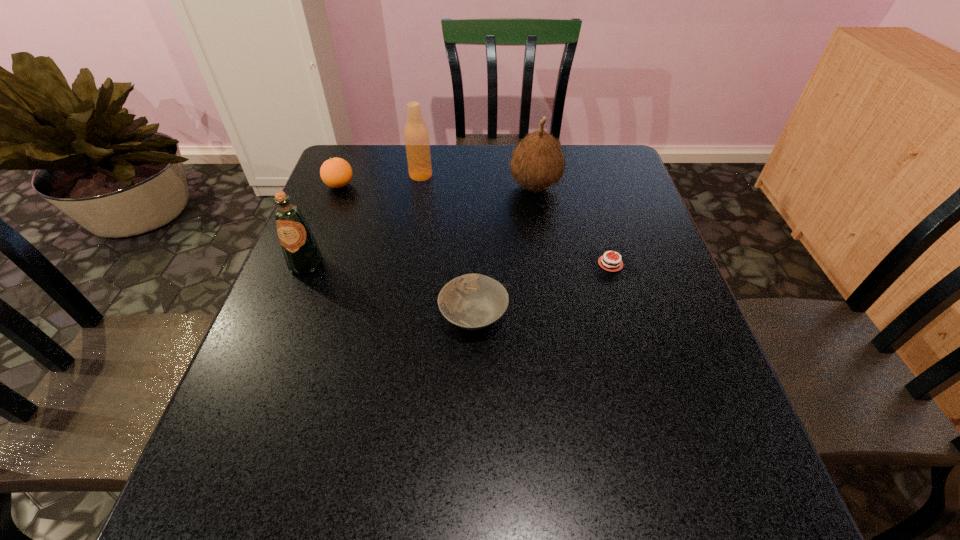
Locate an element on the screen. vacant point located between the beer bottle and the shortest object is located at coordinates (516, 219).

What are the coordinates of `vacant space that is in between the third object from left to right and the second object from right to left` in the screenshot? It's located at (478, 180).

The width and height of the screenshot is (960, 540). What are the coordinates of `free spot between the beer bottle and the fourth tallest object` in the screenshot? It's located at (380, 180).

I want to click on vacant space that's between the olive oil and the shortest object, so click(459, 264).

Identify the location of vacant area that lies between the fourth tallest object and the olive oil. Image resolution: width=960 pixels, height=540 pixels. pyautogui.click(x=324, y=225).

What are the coordinates of `vacant area that lies between the third object from right to left and the coconut` in the screenshot? It's located at (504, 251).

Find the location of a particular element. This screenshot has width=960, height=540. free space between the fourth tallest object and the olive oil is located at coordinates (324, 225).

Where is `empty space between the shortest object and the olive oil`? This screenshot has height=540, width=960. empty space between the shortest object and the olive oil is located at coordinates (x=459, y=264).

Image resolution: width=960 pixels, height=540 pixels. Find the location of `free area in between the fifth object from left to right and the fifth tallest object`. free area in between the fifth object from left to right and the fifth tallest object is located at coordinates (504, 251).

The width and height of the screenshot is (960, 540). What are the coordinates of `the fifth closest object to the olive oil` in the screenshot? It's located at (x=609, y=264).